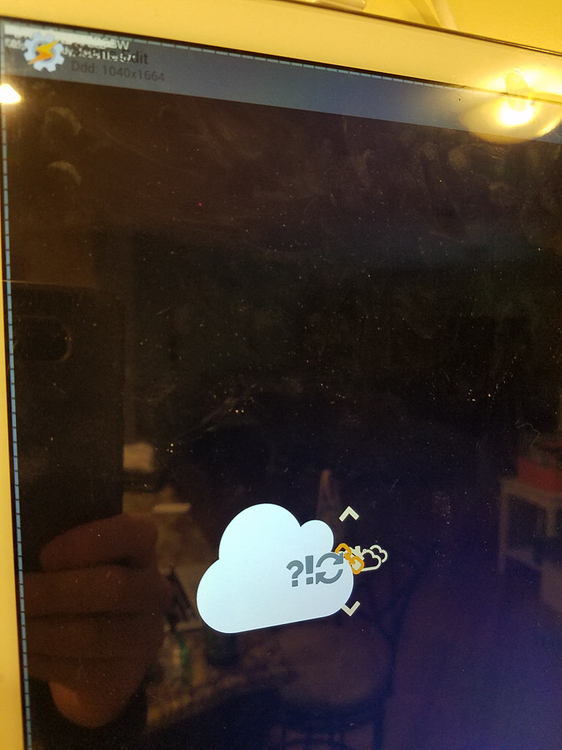
The image size is (562, 750). What are the coordinates of `white overhead light` in the screenshot? It's located at (511, 118).